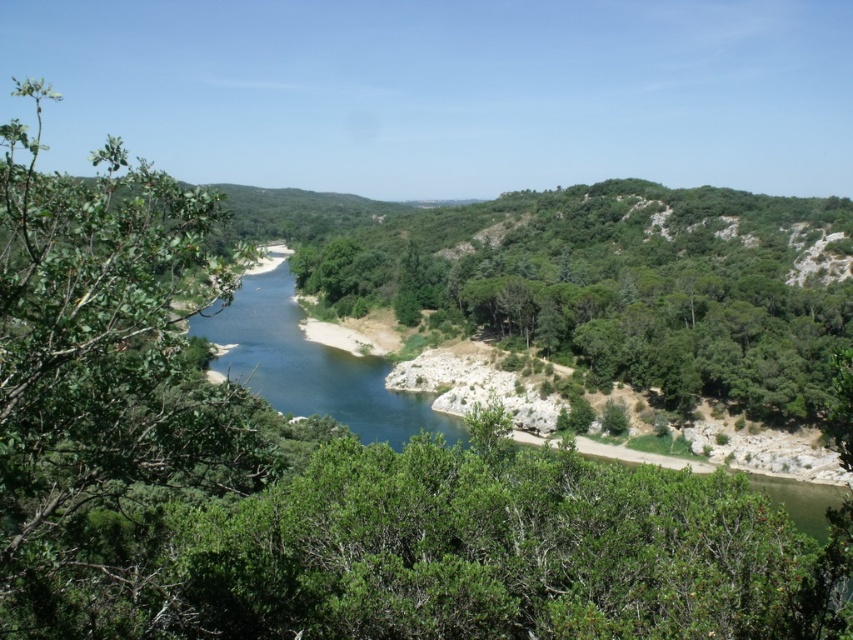
You are a kayaker planning to navigate the river in the image. You have a kayak that is 3 meters wide. The blue water at center and the blue smooth river at center are parts of the same river. Can your kayak fit through the narrower part of the river?

The blue water at center might be wider than blue smooth river at center. Since the blue smooth river at center is the narrower part, and it is not specified how wide it is, but the kayak is 3 meters wide. Without knowing the exact width of the narrower section, it is uncertain if the kayak will fit. Please check the actual width before proceeding.

You are standing at point [434,419] and want to walk to the point [370,355]. Which direction should you move in relation to the river?

You should move towards the river because point [370,355] is behind point [434,419], meaning it is closer to the river in the scene.

You are standing on the edge of the blue smooth river at center and want to cross to the other side. The blue water at center is flowing gently. Which direction should you swim to reach the opposite bank safely?

You should swim towards the blue smooth river at center because the blue water at center is below it, indicating the river flows downward, so swimming against the current might be safer or easier depending on the flow strength. However, based on the description, since the blue water is below, the current direction is downward, so swimming towards the blue smooth river at center would be with the current, making it easier.